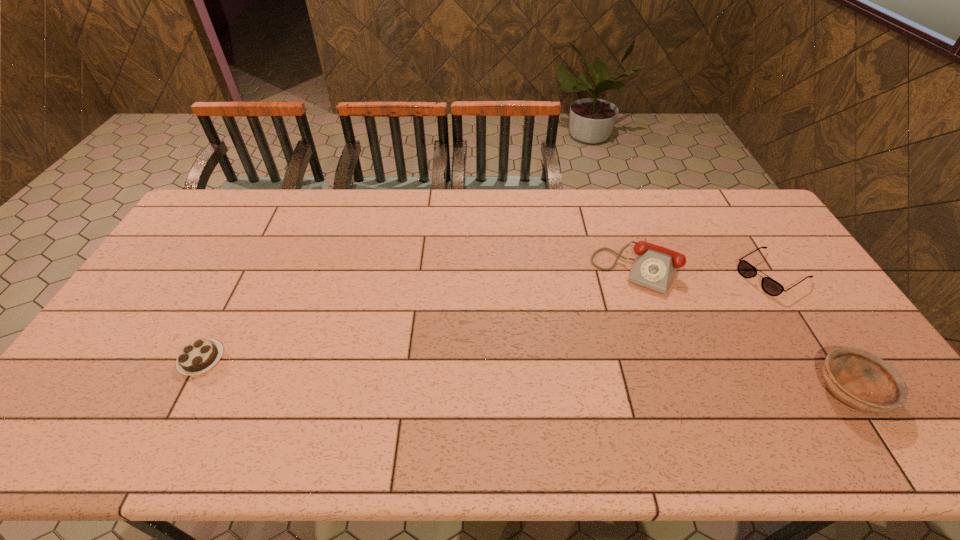
Identify the location of free space at the near edge. (454, 383).

At what (x,y) coordinates should I click in order to perform the action: click on free space at the far left corner of the desktop. Please return your answer as a coordinate pair (x, y). This screenshot has height=540, width=960. Looking at the image, I should click on (236, 214).

At what (x,y) coordinates should I click in order to perform the action: click on vacant space at the far right corner of the desktop. Please return your answer as a coordinate pair (x, y). Looking at the image, I should click on (756, 218).

Where is `vacant region between the telephone and the spectacles`? This screenshot has height=540, width=960. vacant region between the telephone and the spectacles is located at coordinates (704, 271).

At what (x,y) coordinates should I click in order to perform the action: click on vacant area between the leftmost object and the second shortest object. Please return your answer as a coordinate pair (x, y). This screenshot has width=960, height=540. Looking at the image, I should click on (487, 316).

At what (x,y) coordinates should I click in order to perform the action: click on free space between the second tallest object and the shortest object. Please return your answer as a coordinate pair (x, y). Looking at the image, I should click on (526, 375).

Find the location of a particular element. The image size is (960, 540). vacant area between the chocolate cake and the third object from right to left is located at coordinates (419, 313).

Where is `free space between the third tallest object and the bowl`? free space between the third tallest object and the bowl is located at coordinates (811, 332).

Locate an element on the screen. The width and height of the screenshot is (960, 540). vacant region between the second object from left to right and the leftmost object is located at coordinates (419, 313).

At what (x,y) coordinates should I click in order to perform the action: click on vacant point located between the second tallest object and the spectacles. Please return your answer as a coordinate pair (x, y). Looking at the image, I should click on (x=811, y=332).